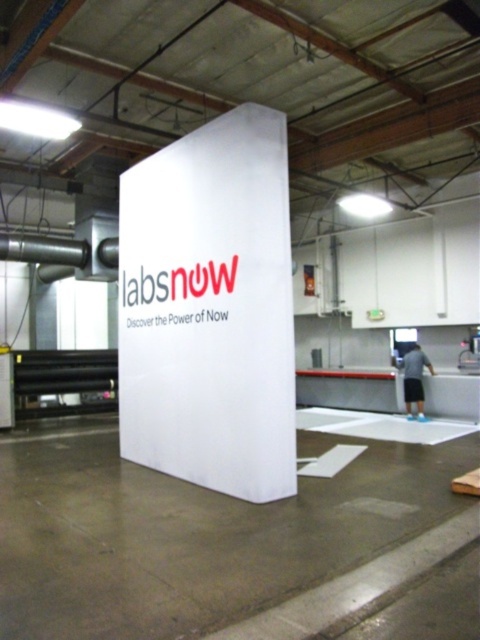
Identify the location of white matte sign at center. Image resolution: width=480 pixels, height=640 pixels. (210, 308).

Who is more distant from viewer, (272, 397) or (407, 356)?

The point (407, 356) is more distant.

Where is `white matte sign at center`? This screenshot has height=640, width=480. white matte sign at center is located at coordinates (210, 308).